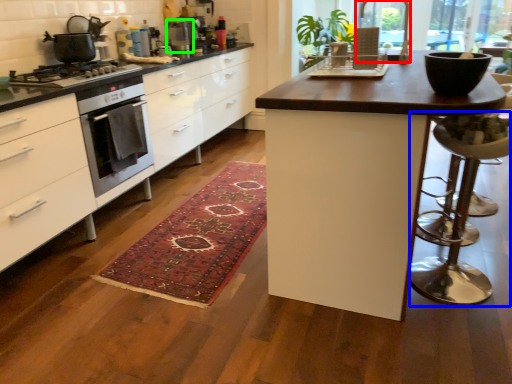
Question: Based on their relative distances, which object is farther from window screen (highlighted by a red box)? Choose from bar stool (highlighted by a blue box) and appliance (highlighted by a green box).

Choices:
 (A) bar stool
 (B) appliance

Answer: (B)